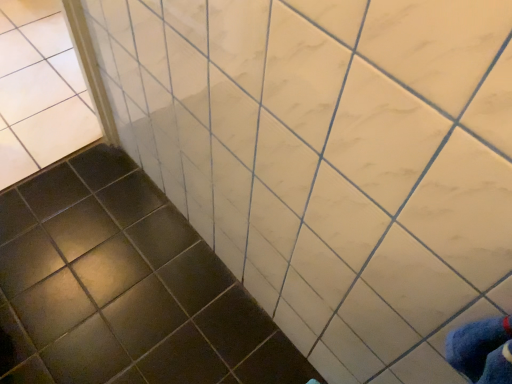
Locate an element on the screen. Image resolution: width=512 pixels, height=384 pixels. black glossy tile at lower left is located at coordinates (124, 288).

What do you see at coordinates (124, 288) in the screenshot? Image resolution: width=512 pixels, height=384 pixels. I see `black glossy tile at lower left` at bounding box center [124, 288].

Locate an element on the screen. black glossy tile at lower left is located at coordinates (124, 288).